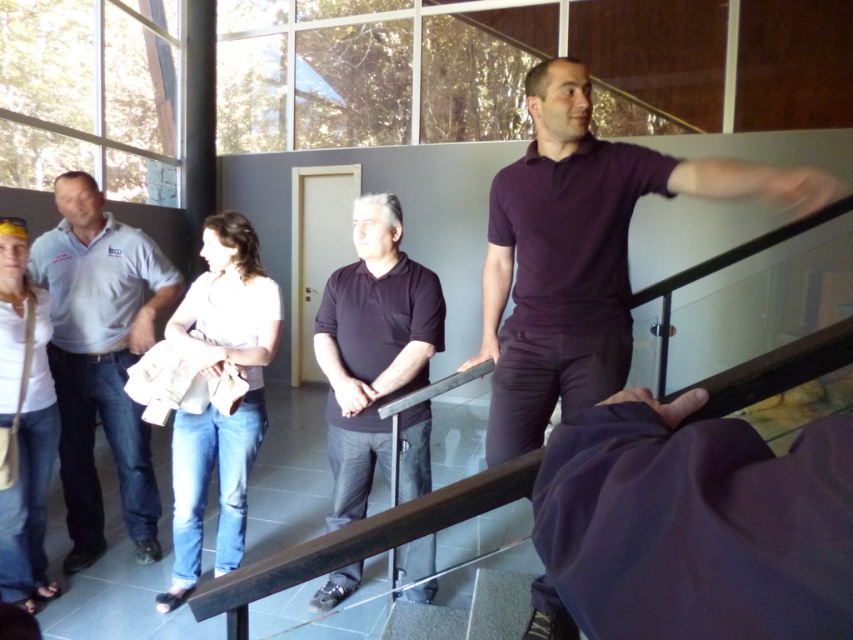
Can you confirm if purple matte shirt at upper right is positioned to the right of dark matte polo shirt at center?

Indeed, purple matte shirt at upper right is positioned on the right side of dark matte polo shirt at center.

Which is in front, point (753, 180) or point (395, 371)?

Positioned in front is point (753, 180).

Between point (560, 364) and point (369, 310), which one is positioned in front?

Point (560, 364) is more forward.

Where is `purple matte shirt at upper right`? purple matte shirt at upper right is located at coordinates (581, 253).

Is dark matte polo shirt at center smaller than black metal/rail at center?

Actually, dark matte polo shirt at center might be larger than black metal/rail at center.

Does point (373, 312) come behind point (706, 380)?

Yes, it is.

Between point (380, 424) and point (756, 240), which one is positioned behind?

The point (380, 424) is more distant.

You are a GUI agent. You are given a task and a screenshot of the screen. Output one action in this format:
    pyautogui.click(x=<x>, y=<y>)
    Task: Click on the dark matte polo shirt at center
    
    Given the screenshot: What is the action you would take?
    (372, 346)

Does light pink fabric shirt at center have a smaller size compared to white matte shirt at lower left?

Actually, light pink fabric shirt at center might be larger than white matte shirt at lower left.

Where is `light pink fabric shirt at center`? light pink fabric shirt at center is located at coordinates (210, 400).

This screenshot has height=640, width=853. I want to click on light pink fabric shirt at center, so click(210, 400).